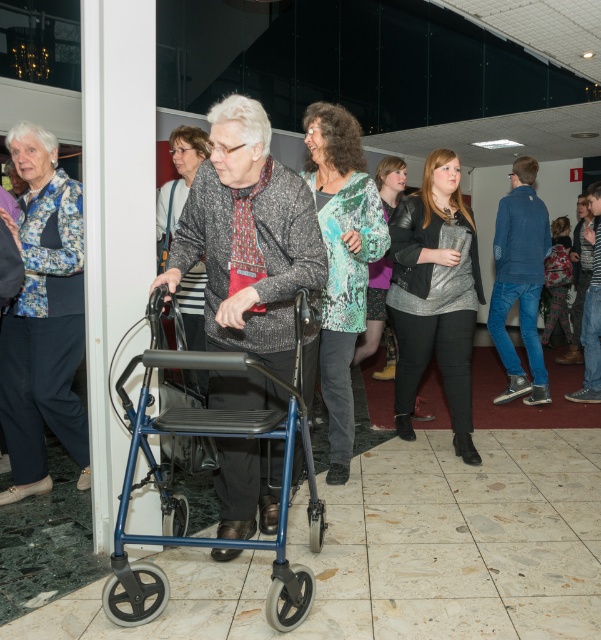
Question: Which object appears closest to the camera in this image?

Choices:
 (A) denim jacket at center
 (B) floral fabric jacket at upper left

Answer: (B)

Question: Is leather jacket at center positioned in front of green textured sweater at center?

Choices:
 (A) no
 (B) yes

Answer: (B)

Question: Which object is positioned closest to the green textured sweater at center?

Choices:
 (A) denim jacket at center
 (B) denim jacket at right
 (C) blue metallic walker at center

Answer: (B)

Question: Estimate the real-world distances between objects in this image. Which object is closer to the green textured sweater at center?

Choices:
 (A) floral backpack at right
 (B) denim jacket at right

Answer: (B)

Question: Does metallic walker at center appear on the right side of blue metallic walker at center?

Choices:
 (A) no
 (B) yes

Answer: (B)

Question: Is leather jacket at center smaller than denim jacket at center?

Choices:
 (A) yes
 (B) no

Answer: (B)